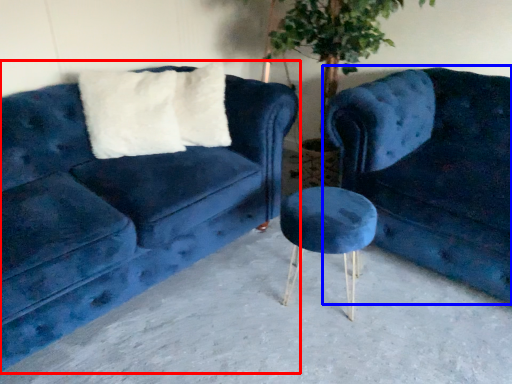
Question: Which point is closer to the camera, studio couch (highlighted by a red box) or studio couch (highlighted by a blue box)?

Choices:
 (A) studio couch
 (B) studio couch

Answer: (A)